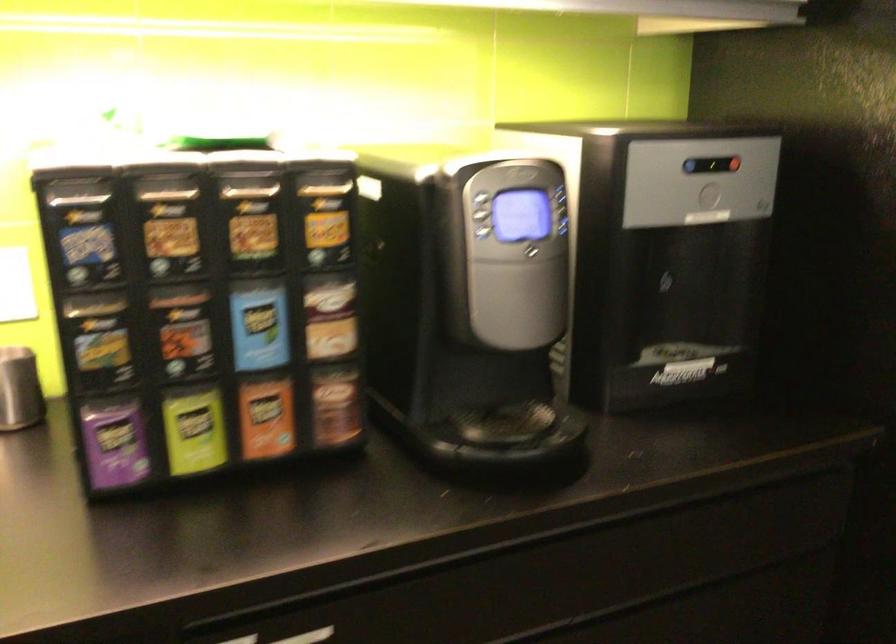
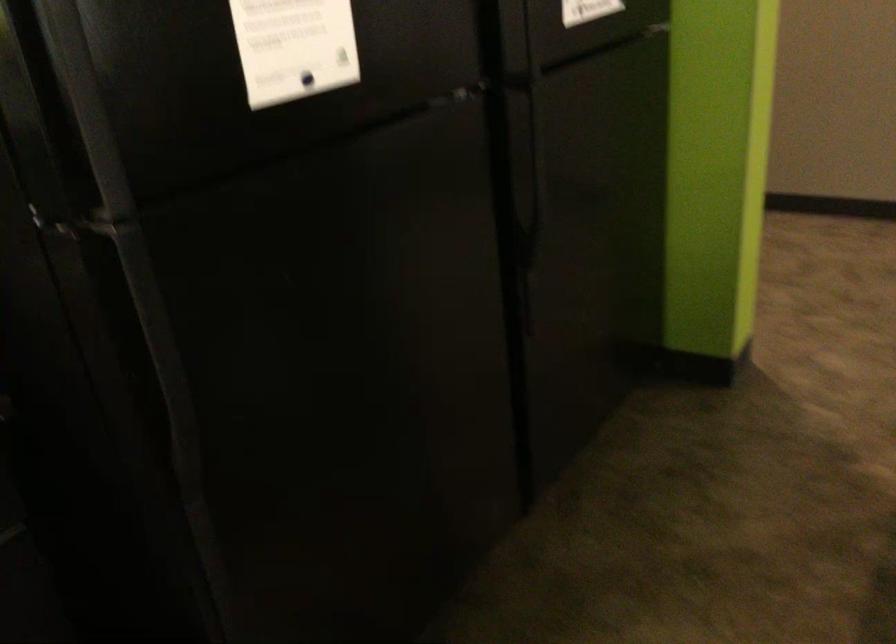
Question: Which direction would the cameraman need to move to produce the second image? Reply with the corresponding letter.

Choices:
 (A) Left
 (B) Right
 (C) Forward
 (D) Backward

Answer: (B)